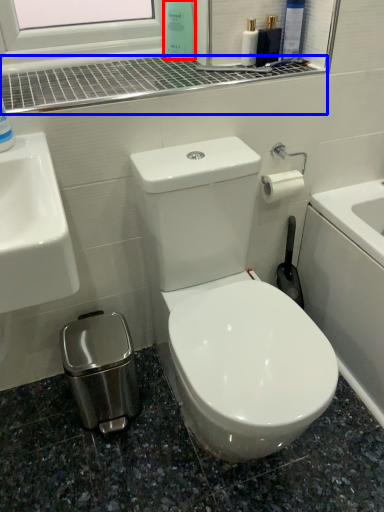
Question: Which of the following is the farthest to the observer, cleaning product (highlighted by a red box) or window sill (highlighted by a blue box)?

Choices:
 (A) cleaning product
 (B) window sill

Answer: (A)